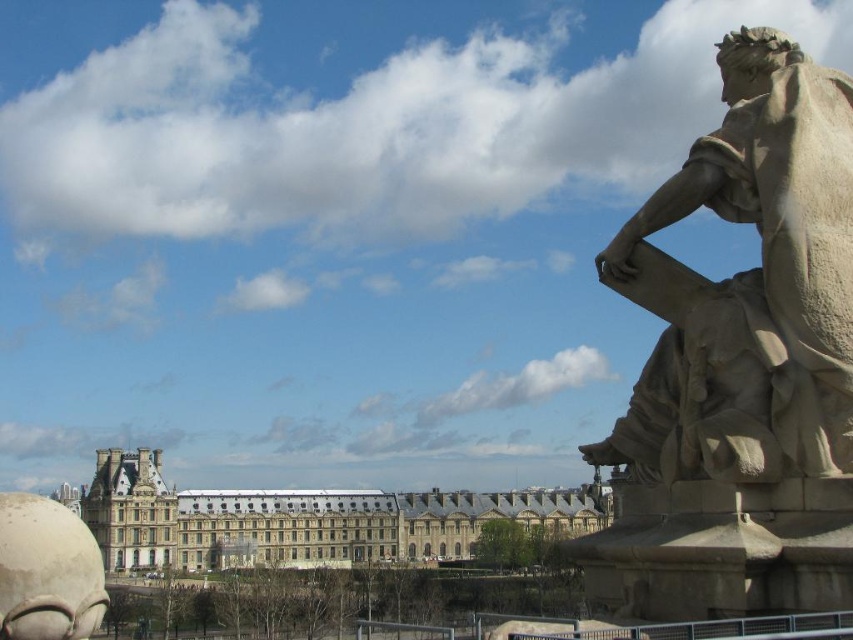
You are standing at the center of the image. You want to take a photo of the smooth stone statue at right. In which direction should you move to get the statue centered in your camera view?

Since the smooth stone statue at right is located at coordinates 0.447 on the x and 0.885 on the y, you should move to the left and down to center it in your camera view.

You are standing in front of the classical statue on the right side of the image. You notice two points marked in the scene. The first point is at coordinate point (738, 58) and the second is at point (126, 512). Which point is nearer to your current position?

Point (738, 58) is closer to the camera than point (126, 512), so the first point is nearer to your current position.